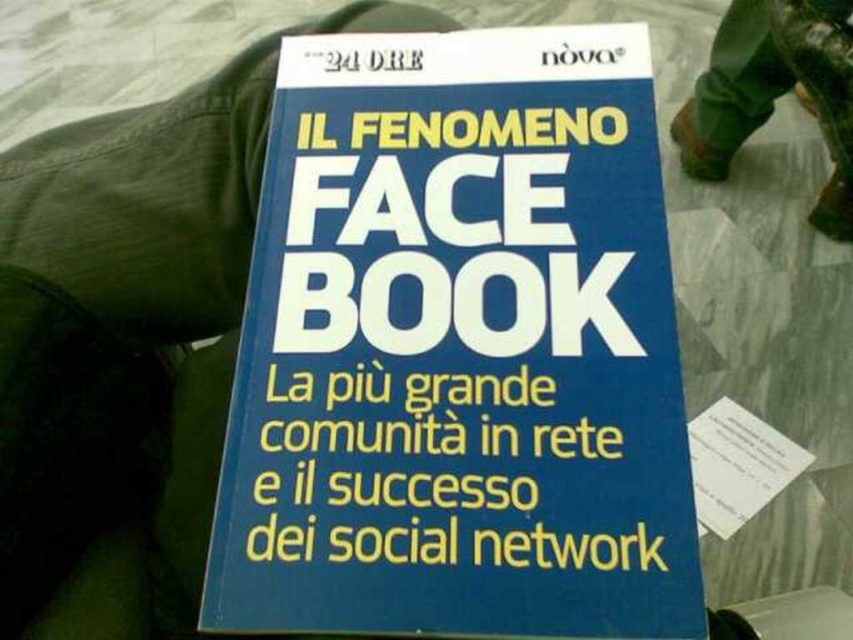
You are trying to determine if the blue paper book at center can be placed on a shelf that can only hold items smaller than the green fabric at upper left. Based on the scene, can the book fit?

The blue paper book at center is smaller than the green fabric at upper left, so it can fit on the shelf.

You have a blue paper book at center and a green fabric at upper left in front of you. Which object is wider?

The blue paper book at center is narrower than the green fabric at upper left.